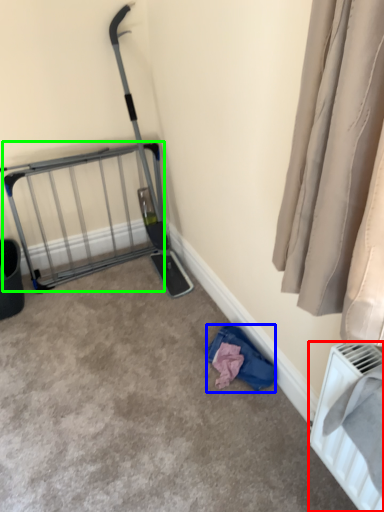
Question: Which is nearer to the radiator (highlighted by a red box)? clothing (highlighted by a blue box) or cage (highlighted by a green box).

Choices:
 (A) clothing
 (B) cage

Answer: (A)